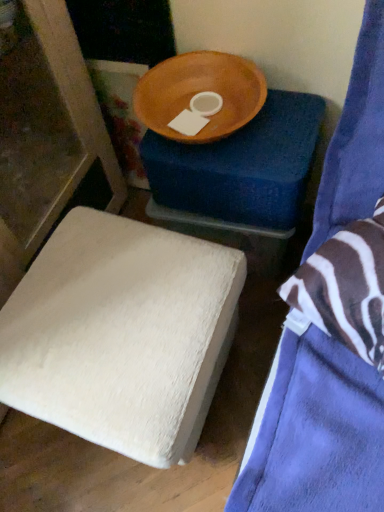
Identify the location of vacant region above wooden bowl at upper center, which ranks as the first furniture in back-to-front order (from a real-world perspective). (225, 114).